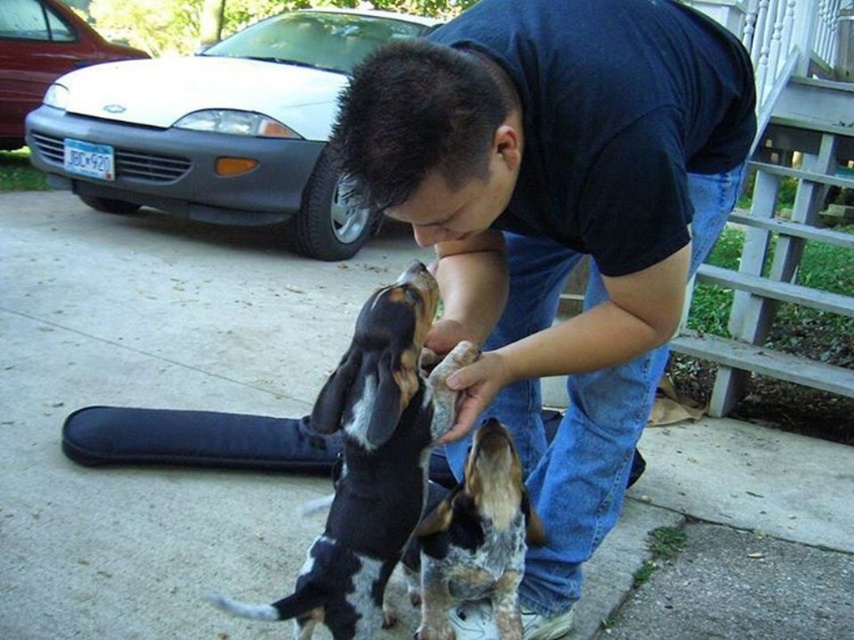
You are a photographer standing 33.62 inches away from the black cotton shirt at center. You want to take a photo of the shirt without any obstruction. Is the white car parked on the driveway in the background blocking your view of the shirt?

The black cotton shirt at center and viewer are 33.62 inches apart. Since the white car is parked in the background, it is behind the shirt and would not block your view. You can take the photo without obstruction.

You are a photographer trying to capture the man and his dogs. You notice the black cotton shirt at center and the spotted fur dog at center. Which one should you focus on if you want to photograph the subject that is higher up?

The black cotton shirt at center is located above the spotted fur dog at center, so you should focus on the black cotton shirt at center to photograph the higher subject.